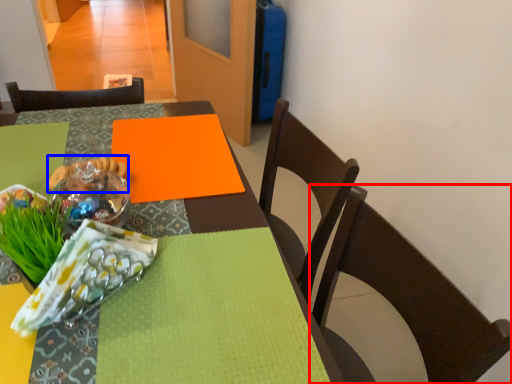
Question: Which object is further to the camera taking this photo, chair (highlighted by a red box) or food (highlighted by a blue box)?

Choices:
 (A) chair
 (B) food

Answer: (B)